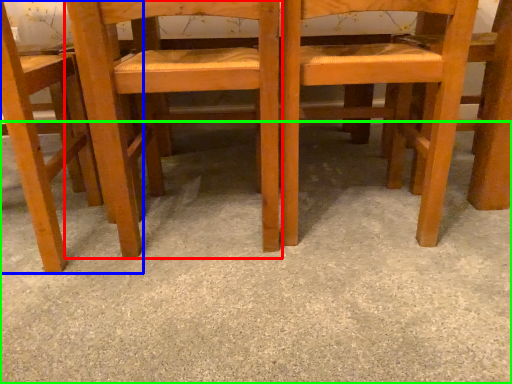
Question: Based on their relative distances, which object is farther from chair (highlighted by a red box)? Choose from chair (highlighted by a blue box) and concrete (highlighted by a green box).

Choices:
 (A) chair
 (B) concrete

Answer: (B)